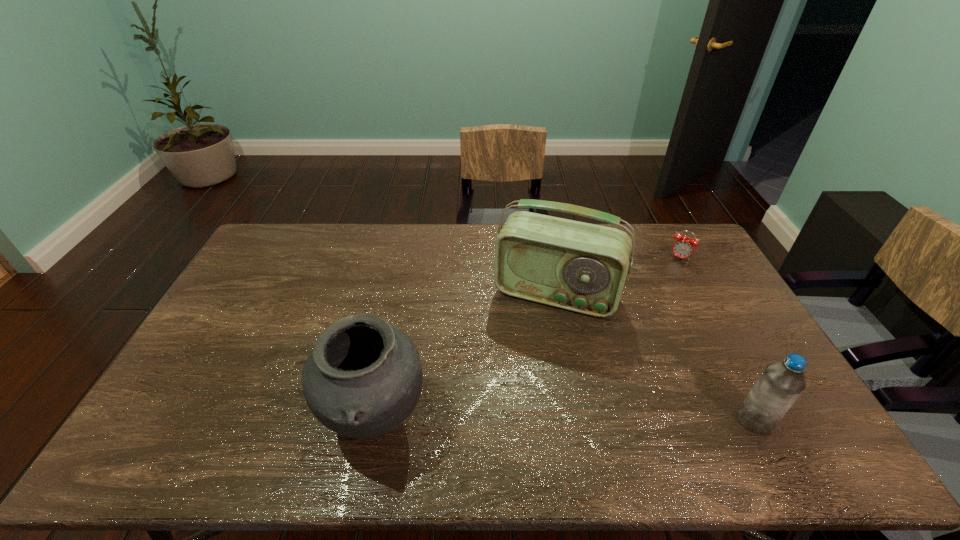
Locate an element on the screen. Image resolution: width=960 pixels, height=540 pixels. urn is located at coordinates (363, 378).

This screenshot has height=540, width=960. Find the location of `the leftmost object`. the leftmost object is located at coordinates (363, 378).

At what (x,y) coordinates should I click in order to perform the action: click on water bottle. Please return your answer as a coordinate pair (x, y). This screenshot has height=540, width=960. Looking at the image, I should click on (781, 383).

Where is `radio receiver`? This screenshot has height=540, width=960. radio receiver is located at coordinates (582, 267).

Find the location of a particular element. This screenshot has width=960, height=540. the third object from right to left is located at coordinates 582,267.

Where is `the shortest object`? Image resolution: width=960 pixels, height=540 pixels. the shortest object is located at coordinates (683, 247).

Identify the location of alarm clock. This screenshot has width=960, height=540. (683, 247).

At what (x,y) coordinates should I click in order to perform the action: click on free space located 0.230m on the right of the third shortest object. Please return your answer as a coordinate pair (x, y). The image size is (960, 540). Looking at the image, I should click on (518, 420).

What are the coordinates of `free space located 0.090m on the back of the third tallest object` in the screenshot? It's located at (732, 377).

Where is `vacant space situated 0.290m on the front panel of the second object from left to right`? vacant space situated 0.290m on the front panel of the second object from left to right is located at coordinates (512, 396).